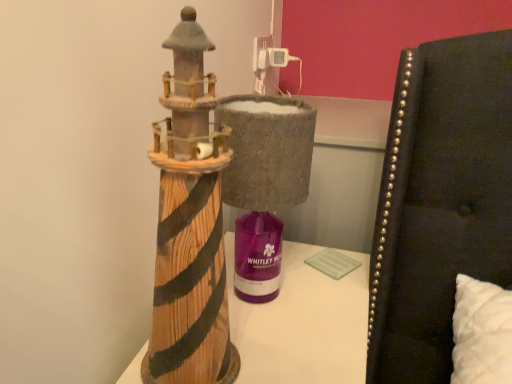
Image resolution: width=512 pixels, height=384 pixels. Identify the location of wooden table at center. (302, 323).

The height and width of the screenshot is (384, 512). What do you see at coordinates (302, 323) in the screenshot?
I see `wooden table at center` at bounding box center [302, 323].

Measure the distance between point (306,254) and camera.

Point (306,254) is 36.46 inches from camera.

This screenshot has height=384, width=512. I want to click on wooden table at center, so [x=302, y=323].